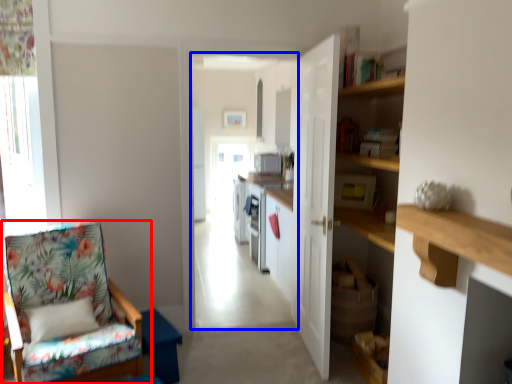
Question: Which object appears closest to the camera in this image, chair (highlighted by a red box) or corridor (highlighted by a blue box)?

Choices:
 (A) chair
 (B) corridor

Answer: (A)